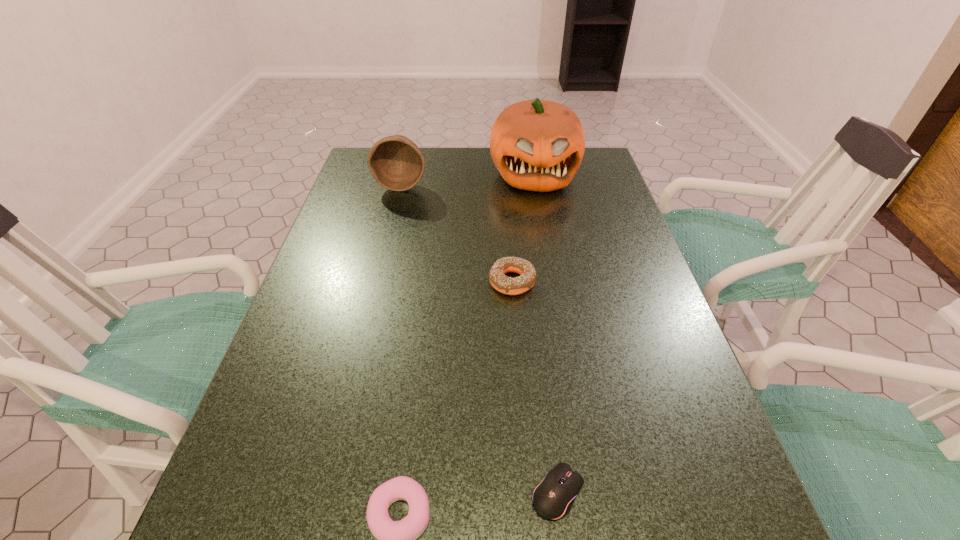
You are a GUI agent. You are given a task and a screenshot of the screen. Output one action in this format:
    pyautogui.click(x=<x>, y=<y>)
    Task: Click on the object at the left edge
    The width and height of the screenshot is (960, 540).
    Given the screenshot: What is the action you would take?
    pyautogui.click(x=396, y=162)

I want to click on object that is at the right edge, so pyautogui.click(x=538, y=145).

This screenshot has width=960, height=540. What are the coordinates of `object situated at the far left corner` in the screenshot? It's located at (396, 162).

The width and height of the screenshot is (960, 540). What are the coordinates of `object that is at the far right corner` in the screenshot? It's located at (538, 145).

Locate an element on the screen. Image resolution: width=960 pixels, height=540 pixels. vacant space at the far edge is located at coordinates (477, 173).

In the image, there is a desktop. At what (x,y) coordinates should I click in order to perform the action: click on vacant space at the left edge. Please return your answer as a coordinate pair (x, y). The image size is (960, 540). Looking at the image, I should click on (338, 374).

This screenshot has width=960, height=540. Identify the location of vacant space at the right edge. (599, 254).

I want to click on vacant space at the far right corner of the desktop, so click(599, 160).

At what (x,y) coordinates should I click in order to perform the action: click on free spot between the bowl and the third farthest object. Please return your answer as a coordinate pair (x, y). This screenshot has width=960, height=540. Looking at the image, I should click on (457, 233).

You are a GUI agent. You are given a task and a screenshot of the screen. Output one action in this format:
    pyautogui.click(x=<x>, y=<y>)
    Task: Click on the free space between the fourth shortest object and the computer mouse
    
    Given the screenshot: What is the action you would take?
    pyautogui.click(x=480, y=339)